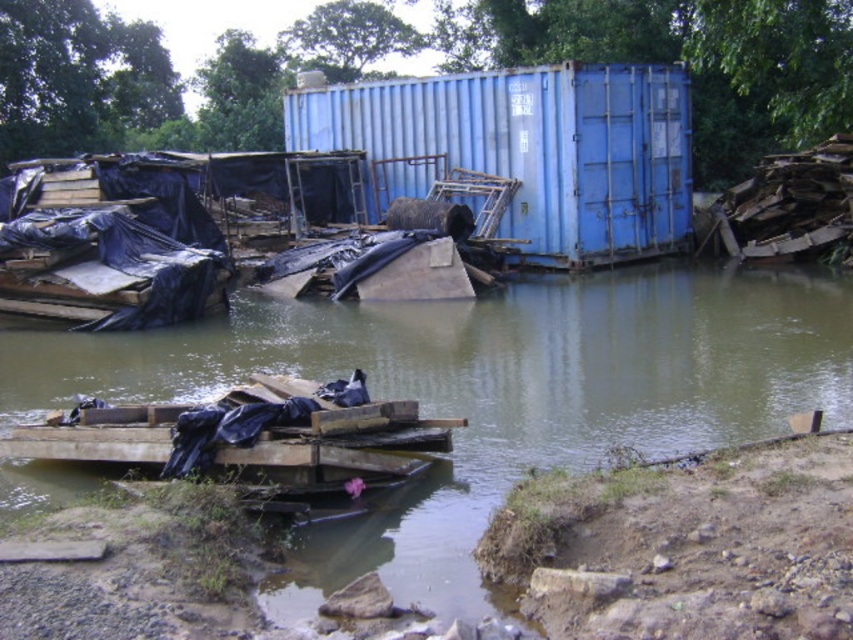
Which is more to the right, brown muddy water at center or blue matte shipping container at center?

blue matte shipping container at center

Which is more to the left, brown muddy water at center or blue matte shipping container at center?

From the viewer's perspective, brown muddy water at center appears more on the left side.

Which is in front, point (569, 452) or point (503, 140)?

Point (569, 452) is more forward.

Where is `brown muddy water at center`? brown muddy water at center is located at coordinates (489, 392).